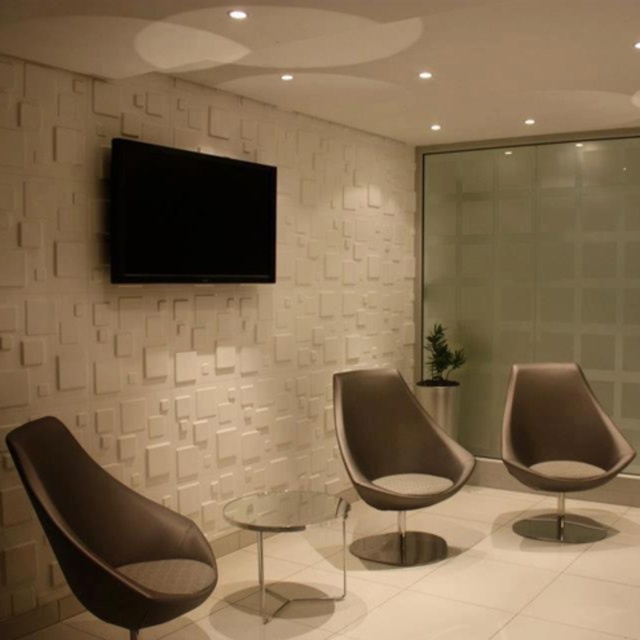
You are planning to place a rectangular side table between the two chairs. The side table is 1.2 meters wide. Can both the matte black chair at lower left and the matte brown chair at center fit on either side of the table without overlapping?

The matte black chair at lower left has a lesser width compared to the matte brown chair at center. Since the side table is 1.2 meters wide, both chairs can fit on either side as long as their combined widths do not exceed the table length. However, the exact feasibility depends on the chairs actual dimensions, which aren

You are designing a seating arrangement for a meeting. You have two chairs available in the room, the matte black chair at lower left and the matte brown chair at center. Which chair would be more suitable for someone who prefers a lower seating height?

The matte black chair at lower left has a lesser height compared to the matte brown chair at center, so it would be more suitable for someone who prefers a lower seating height.

You are standing at the point marked as point (122,561) in the room. You need to walk to the door located at the opposite end of the room. If your walking speed is 1.5 meters per second, how many seconds will it take you to reach the door?

The distance between the point (122,561) and the door is 2.94 meters. At a walking speed of 1.5 meters per second, it will take approximately 1.96 seconds to reach the door.